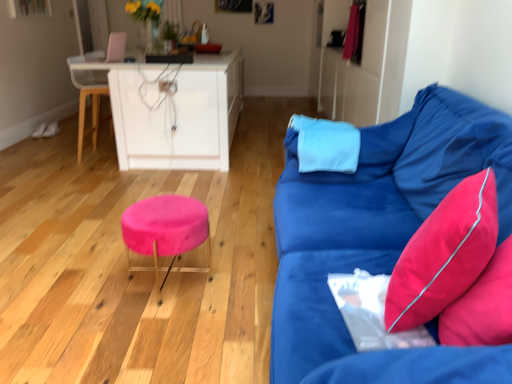
Question: Can you confirm if velvet blue couch at right is thinner than wooden swivel chair at left?

Choices:
 (A) no
 (B) yes

Answer: (A)

Question: Does velvet blue couch at right appear on the right side of wooden swivel chair at left?

Choices:
 (A) yes
 (B) no

Answer: (A)

Question: From the image's perspective, is velvet blue couch at right under wooden swivel chair at left?

Choices:
 (A) no
 (B) yes

Answer: (B)

Question: From a real-world perspective, is velvet blue couch at right under wooden swivel chair at left?

Choices:
 (A) yes
 (B) no

Answer: (B)

Question: Could you tell me if velvet blue couch at right is facing wooden swivel chair at left?

Choices:
 (A) no
 (B) yes

Answer: (A)

Question: In terms of height, does wooden swivel chair at left look taller or shorter compared to velvet pink stool at center?

Choices:
 (A) short
 (B) tall

Answer: (B)

Question: From the image's perspective, relative to velvet pink stool at center, is wooden swivel chair at left above or below?

Choices:
 (A) above
 (B) below

Answer: (A)

Question: Is wooden swivel chair at left in front of or behind velvet pink stool at center in the image?

Choices:
 (A) front
 (B) behind

Answer: (B)

Question: From a real-world perspective, is wooden swivel chair at left physically located above or below velvet pink stool at center?

Choices:
 (A) above
 (B) below

Answer: (A)

Question: From a real-world perspective, is light blue fabric pillow at center, placed as the 2th pillow when sorted from bottom to top, above or below velvet pink stool at center?

Choices:
 (A) above
 (B) below

Answer: (A)

Question: From the image's perspective, is light blue fabric pillow at center, the first pillow in the top-to-bottom sequence, positioned above or below velvet pink stool at center?

Choices:
 (A) below
 (B) above

Answer: (B)

Question: In the image, is light blue fabric pillow at center, which is the 2th pillow in front-to-back order, on the left side or the right side of velvet pink stool at center?

Choices:
 (A) right
 (B) left

Answer: (A)

Question: In the image, is light blue fabric pillow at center, the first pillow in the top-to-bottom sequence, positioned in front of or behind velvet pink stool at center?

Choices:
 (A) front
 (B) behind

Answer: (B)

Question: From the image's perspective, relative to velvet pink stool at center, is velvet pink pillow at right, which ranks as the 1th pillow in bottom-to-top order, above or below?

Choices:
 (A) below
 (B) above

Answer: (B)

Question: Is velvet pink pillow at right, the second pillow from the back, inside or outside of velvet pink stool at center?

Choices:
 (A) inside
 (B) outside

Answer: (B)